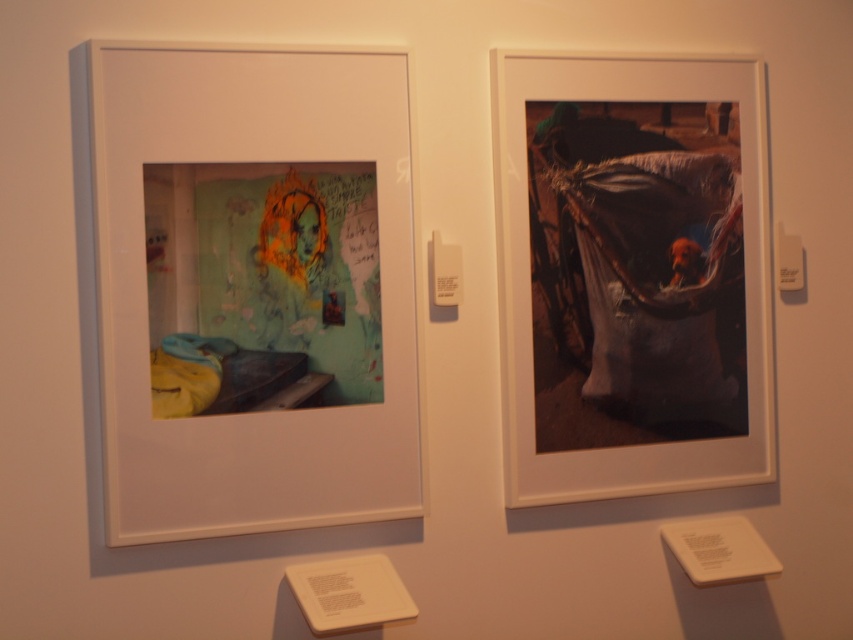
Does matte plastic bag at right have a lesser width compared to matte paper picture frame at left?

In fact, matte plastic bag at right might be wider than matte paper picture frame at left.

Does point (572, 326) come farther from viewer compared to point (111, 376)?

Yes.

At what (x,y) coordinates should I click in order to perform the action: click on matte plastic bag at right. Please return your answer as a coordinate pair (x, y). This screenshot has width=853, height=640. Looking at the image, I should click on (631, 275).